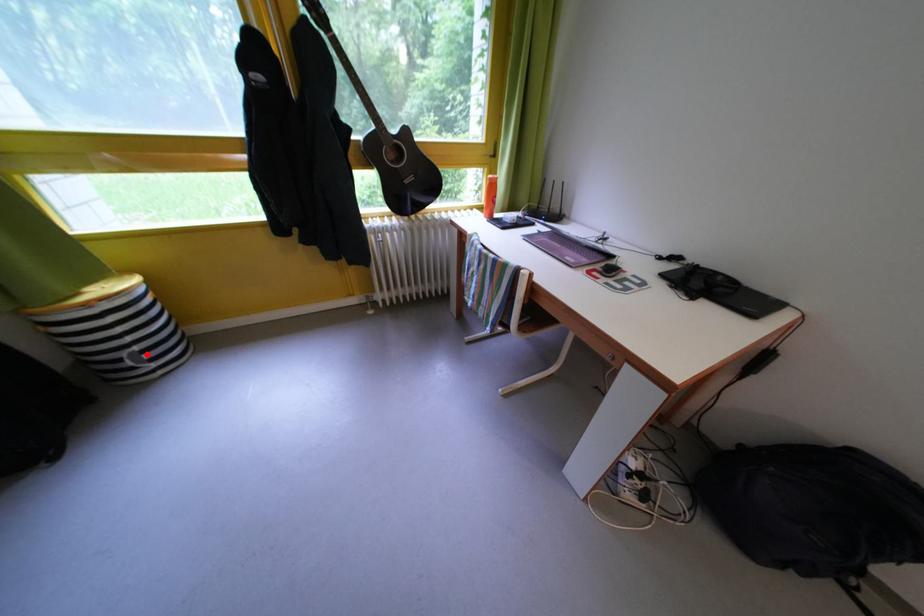
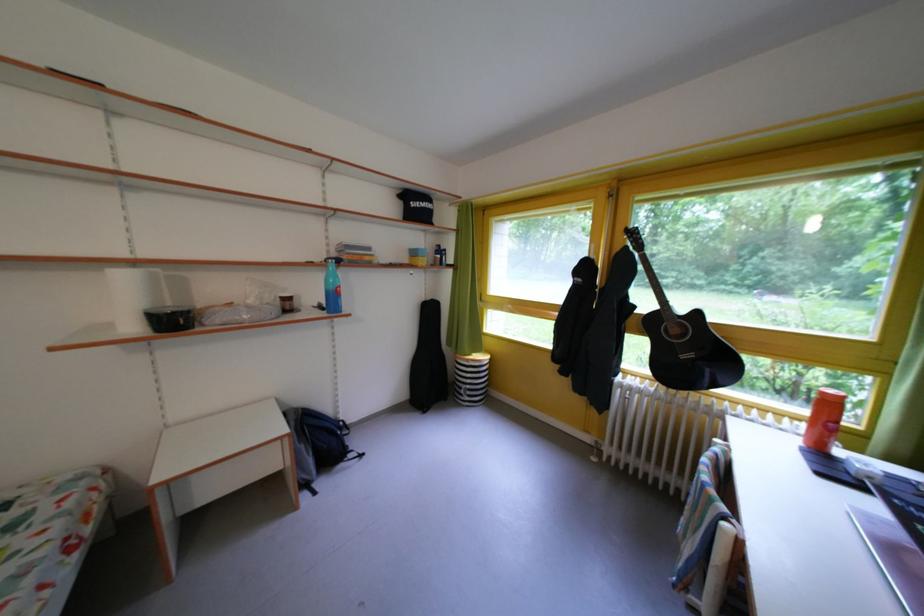
Locate, in the second image, the point that corresponds to the highlighted location in the first image.

(478, 392)